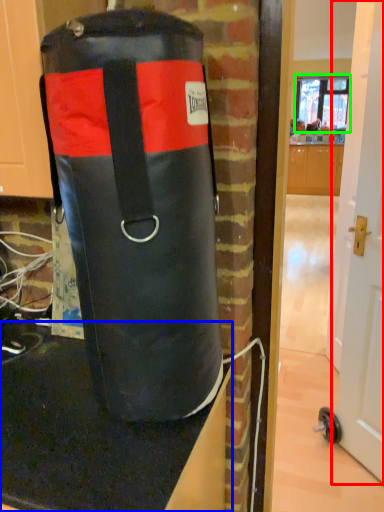
Question: Based on their relative distances, which object is nearer to door (highlighted by a red box)? Choose from table top (highlighted by a blue box) and window screen (highlighted by a green box).

Choices:
 (A) table top
 (B) window screen

Answer: (A)